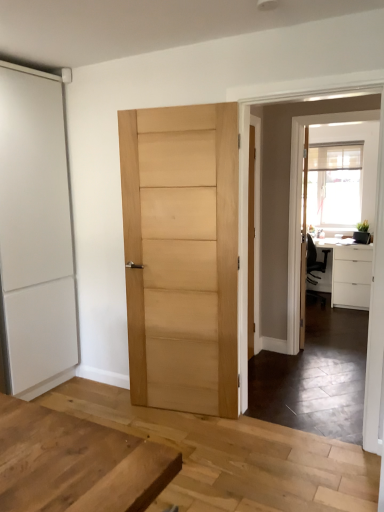
Question: Is clear glass screen door at upper right to the left of natural wood door at center, which is the first door in right-to-left order, from the viewer's perspective?

Choices:
 (A) no
 (B) yes

Answer: (A)

Question: From the image's perspective, is clear glass screen door at upper right on top of natural wood door at center, which is the first door in right-to-left order?

Choices:
 (A) no
 (B) yes

Answer: (B)

Question: Is clear glass screen door at upper right completely or partially outside of natural wood door at center, which is the first door in right-to-left order?

Choices:
 (A) yes
 (B) no

Answer: (A)

Question: Is clear glass screen door at upper right facing towards natural wood door at center, which is the first door in right-to-left order?

Choices:
 (A) yes
 (B) no

Answer: (B)

Question: From a real-world perspective, is clear glass screen door at upper right located higher than natural wood door at center, which is the first door in right-to-left order?

Choices:
 (A) no
 (B) yes

Answer: (B)

Question: Is white matte sliding door at left, which ranks as the second door in right-to-left order, inside the boundaries of natural wood door at center, which is the first door in right-to-left order, or outside?

Choices:
 (A) inside
 (B) outside

Answer: (B)

Question: Does point tap(3, 121) appear closer or farther from the camera than point tap(147, 165)?

Choices:
 (A) closer
 (B) farther

Answer: (A)

Question: Considering the positions of white matte sliding door at left, placed as the first door when sorted from left to right, and natural wood door at center, which is the first door in right-to-left order, in the image, is white matte sliding door at left, placed as the first door when sorted from left to right, taller or shorter than natural wood door at center, which is the first door in right-to-left order,?

Choices:
 (A) short
 (B) tall

Answer: (B)

Question: Visually, is white matte sliding door at left, placed as the first door when sorted from left to right, positioned to the left or to the right of natural wood door at center, the second door from the left?

Choices:
 (A) left
 (B) right

Answer: (A)

Question: From the image's perspective, relative to clear glass screen door at upper right, is natural wood door at center, which is the first door in right-to-left order, above or below?

Choices:
 (A) above
 (B) below

Answer: (B)

Question: In the image, is natural wood door at center, which is the first door in right-to-left order, on the left side or the right side of clear glass screen door at upper right?

Choices:
 (A) left
 (B) right

Answer: (A)

Question: Choose the correct answer: Is natural wood door at center, the second door from the left, inside clear glass screen door at upper right or outside it?

Choices:
 (A) inside
 (B) outside

Answer: (B)

Question: In terms of width, does natural wood door at center, which is the first door in right-to-left order, look wider or thinner when compared to clear glass screen door at upper right?

Choices:
 (A) thin
 (B) wide

Answer: (B)

Question: From the image's perspective, relative to white matte sliding door at left, placed as the first door when sorted from left to right, is white matte cabinet at right above or below?

Choices:
 (A) above
 (B) below

Answer: (B)

Question: Looking at their shapes, would you say white matte cabinet at right is wider or thinner than white matte sliding door at left, which ranks as the second door in right-to-left order?

Choices:
 (A) wide
 (B) thin

Answer: (A)